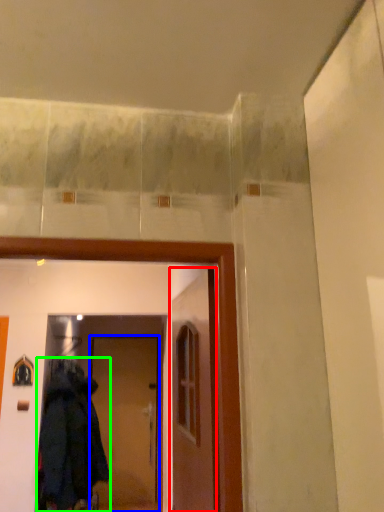
Question: Based on their relative distances, which object is nearer to door (highlighted by a red box)? Choose from door (highlighted by a blue box) and coat (highlighted by a green box).

Choices:
 (A) door
 (B) coat

Answer: (B)